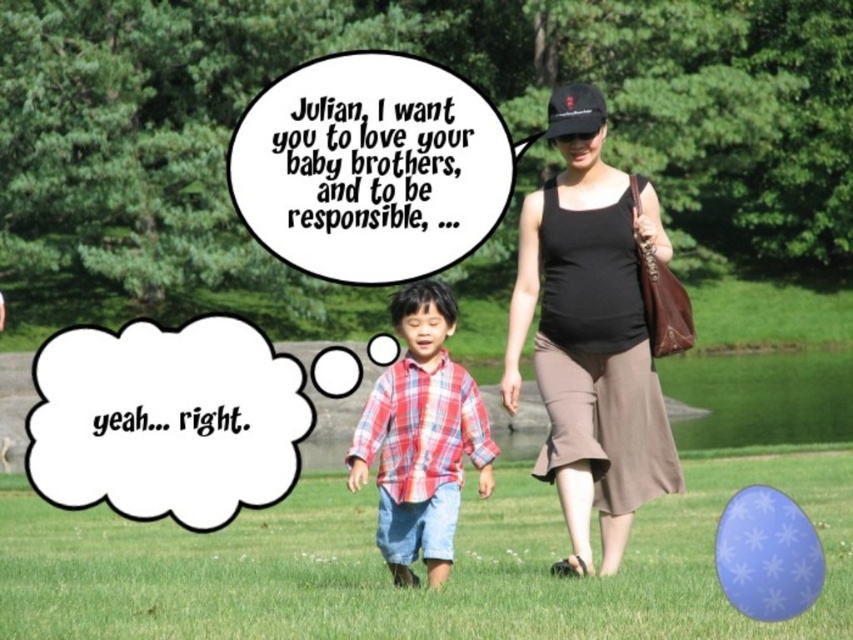
Question: Which of the following is the closest to the observer?

Choices:
 (A) black fabric tank top at center
 (B) black fabric baseball cap at upper center
 (C) green grass at lower center
 (D) plaid fabric shirt at center

Answer: (C)

Question: Which object is farther from the camera taking this photo?

Choices:
 (A) black fabric tank top at center
 (B) black fabric baseball cap at upper center
 (C) green grass at lower center

Answer: (B)

Question: Is black fabric tank top at center positioned behind black fabric baseball cap at upper center?

Choices:
 (A) yes
 (B) no

Answer: (B)

Question: Can you confirm if plaid fabric shirt at center is thinner than black fabric baseball cap at upper center?

Choices:
 (A) yes
 (B) no

Answer: (B)

Question: From the image, what is the correct spatial relationship of green grass at lower center in relation to black fabric baseball cap at upper center?

Choices:
 (A) below
 (B) above

Answer: (A)

Question: Considering the real-world distances, which object is closest to the black fabric tank top at center?

Choices:
 (A) green grass at lower center
 (B) black fabric baseball cap at upper center

Answer: (B)